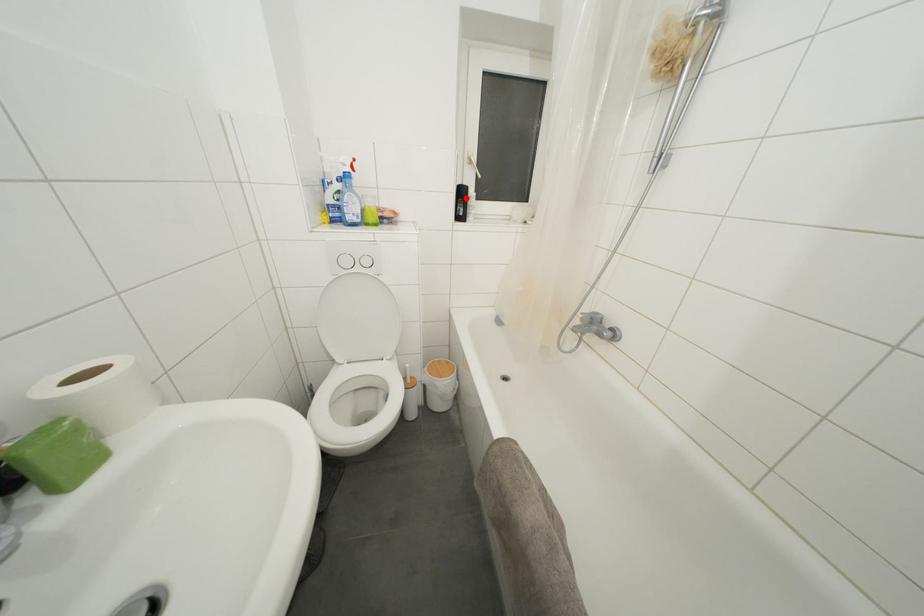
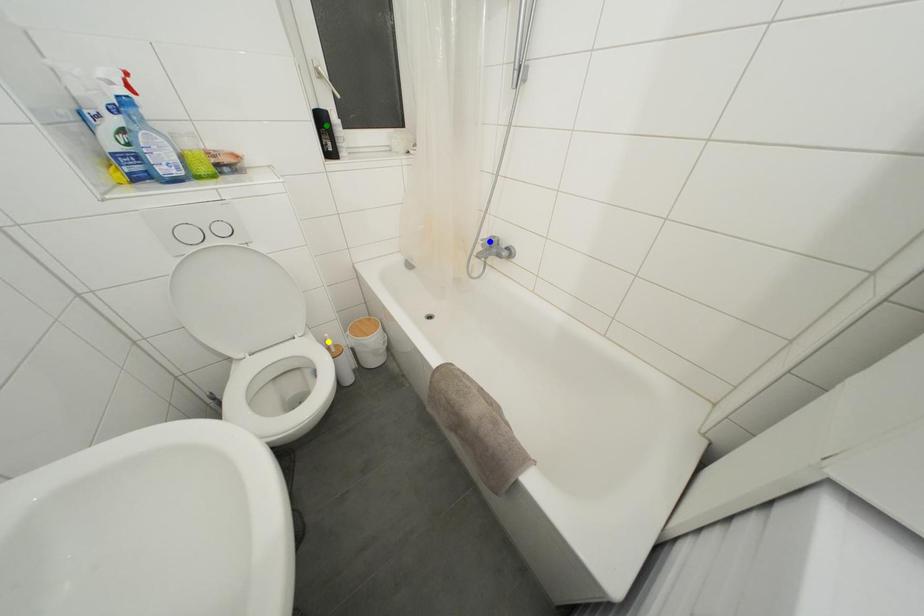
Question: I am providing you with two images of the same scene from different viewpoints. A red point is marked on the first image. You are given multiple points on the second image. Which point in image 2 is actually the same real-world point as the red point in image 1?

Choices:
 (A) yellow point
 (B) blue point
 (C) green point

Answer: (C)